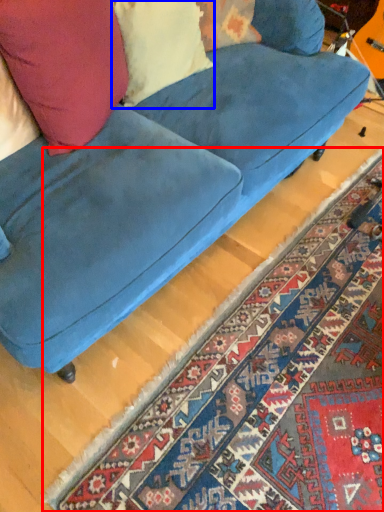
Question: Among these objects, which one is farthest to the camera, mat (highlighted by a red box) or pillow (highlighted by a blue box)?

Choices:
 (A) mat
 (B) pillow

Answer: (B)